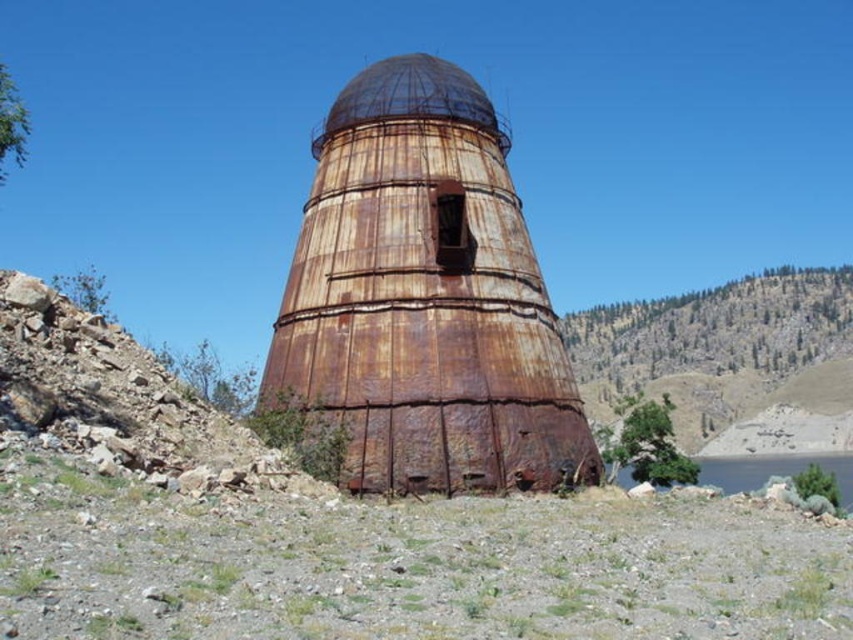
Question: Can you confirm if rusty metal tower at center is bigger than green grassy lake at lower right?

Choices:
 (A) no
 (B) yes

Answer: (A)

Question: Is rusty metal tower at center behind green grassy lake at lower right?

Choices:
 (A) no
 (B) yes

Answer: (A)

Question: Which point appears closest to the camera in this image?

Choices:
 (A) (473, 116)
 (B) (276, 401)

Answer: (B)

Question: Which of the following is the closest to the observer?

Choices:
 (A) tap(370, 467)
 (B) tap(851, 314)
 (C) tap(741, 490)

Answer: (A)

Question: Does rusty metal tower at center appear on the right side of green grassy lake at lower right?

Choices:
 (A) no
 (B) yes

Answer: (A)

Question: Which object appears closest to the camera in this image?

Choices:
 (A) green grassy hillside at upper center
 (B) rusty metal tower at center
 (C) rusty metal dome at center

Answer: (B)